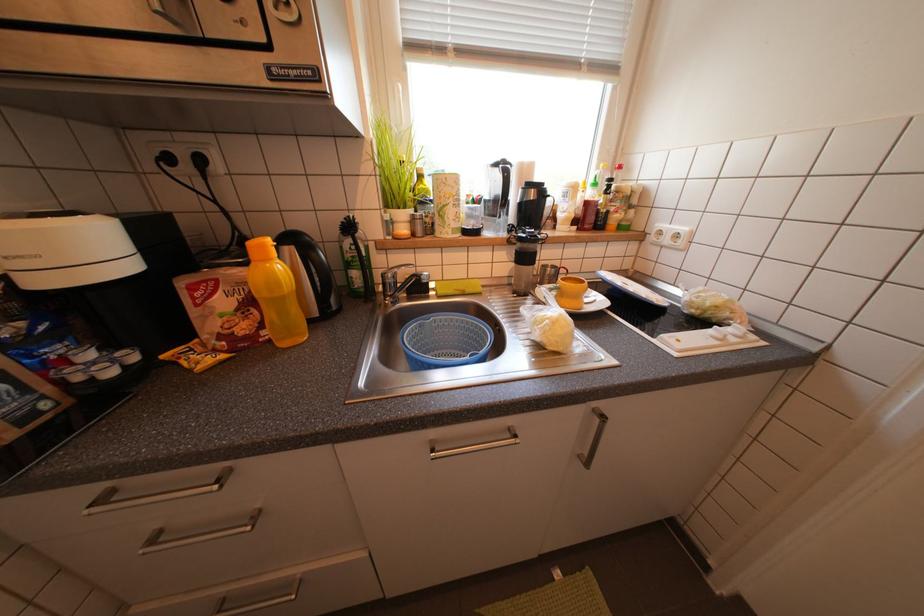
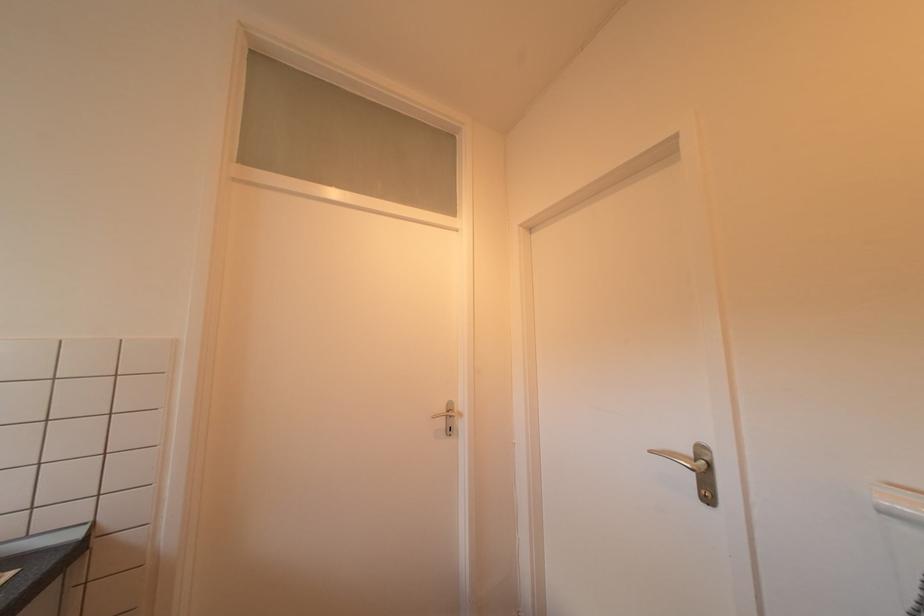
Question: The images are taken continuously from a first-person perspective. In which direction is your viewpoint rotating?

Choices:
 (A) Left
 (B) Right
 (C) Up
 (D) Down

Answer: (B)